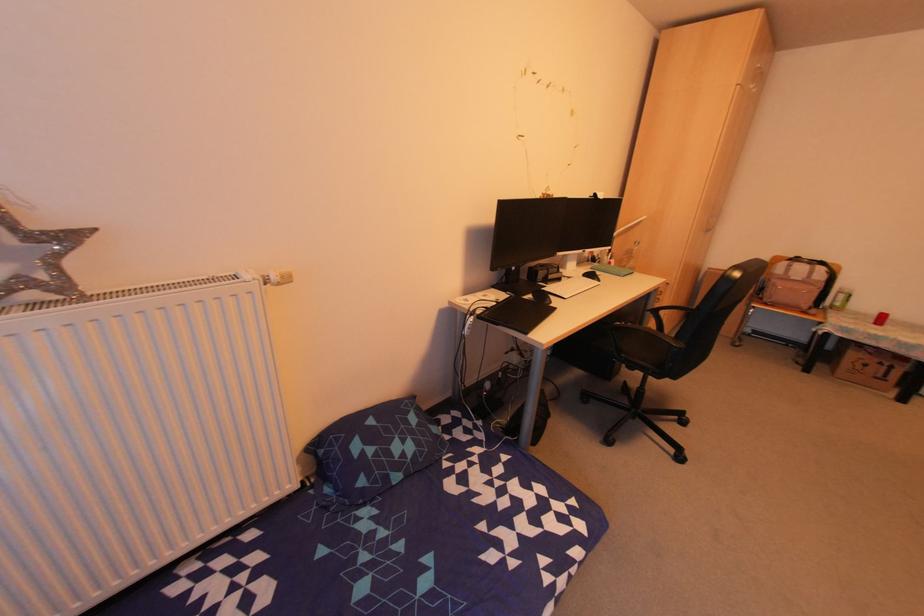
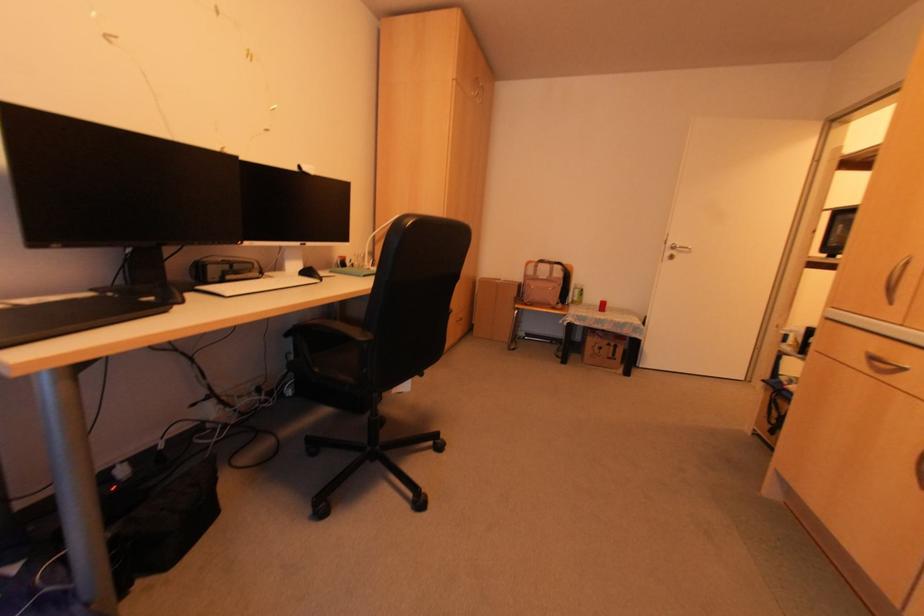
The point at (797, 280) is marked in the first image. Where is the corresponding point in the second image?

(542, 278)